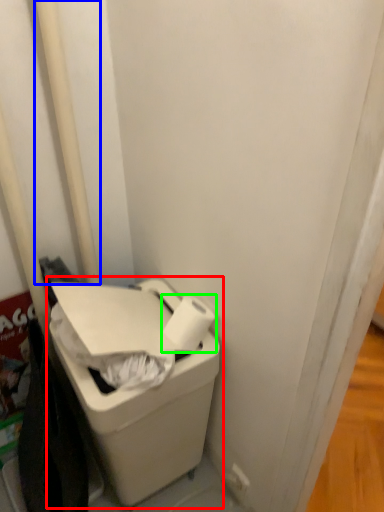
Question: Which object is the closest to the waste container (highlighted by a red box)? Choose among these: pole (highlighted by a blue box) or toilet paper (highlighted by a green box).

Choices:
 (A) pole
 (B) toilet paper

Answer: (B)